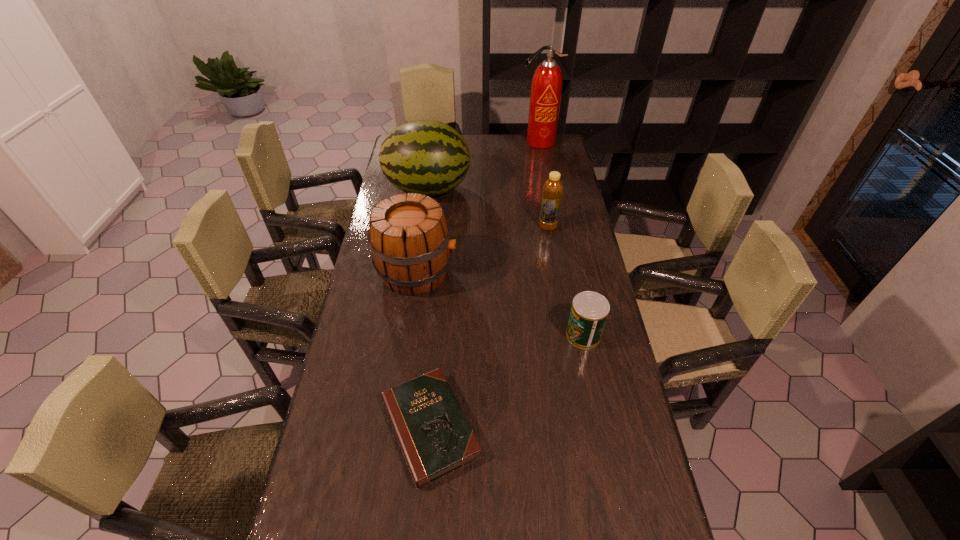
Find the location of a particular element. free location located 0.390m at the stem end of the watermelon is located at coordinates (565, 189).

You are a GUI agent. You are given a task and a screenshot of the screen. Output one action in this format:
    pyautogui.click(x=<x>, y=<y>)
    Task: Click on the vacant space positioned on the side of the third nearest object where the spigot is located
    Image resolution: width=960 pixels, height=540 pixels.
    Given the screenshot: What is the action you would take?
    click(x=561, y=272)

Identify the location of free point located on the front of the fourth nearest object. (552, 249).

This screenshot has height=540, width=960. Identify the location of free region located on the back of the second shortest object. (569, 265).

At what (x,y) coordinates should I click in order to perform the action: click on vacant point located on the right of the nearest object. Please return your answer as a coordinate pair (x, y). This screenshot has width=960, height=540. Looking at the image, I should click on (549, 427).

The height and width of the screenshot is (540, 960). What are the coordinates of `object at the far edge` in the screenshot? It's located at (546, 88).

Where is `watermelon at the left edge`? watermelon at the left edge is located at coordinates (428, 157).

Where is `cider present at the left edge`? This screenshot has width=960, height=540. cider present at the left edge is located at coordinates (409, 237).

At what (x,y) coordinates should I click in order to perform the action: click on Bible that is at the left edge. Please return your answer as a coordinate pair (x, y). This screenshot has height=540, width=960. Looking at the image, I should click on (435, 437).

The image size is (960, 540). Identify the location of fire extinguisher present at the right edge. (546, 88).